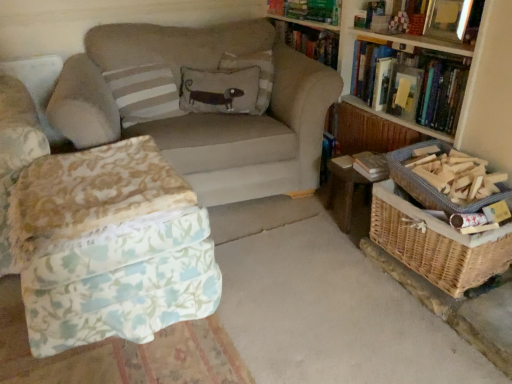
I want to click on vacant region in front of woven wood table at lower right, so click(x=335, y=256).